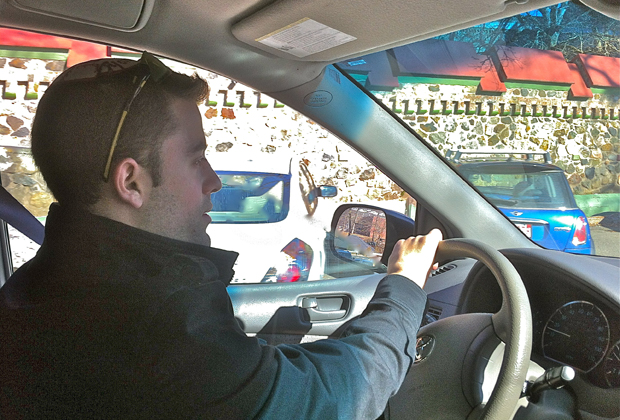
Identify the location of mirror. (361, 222).